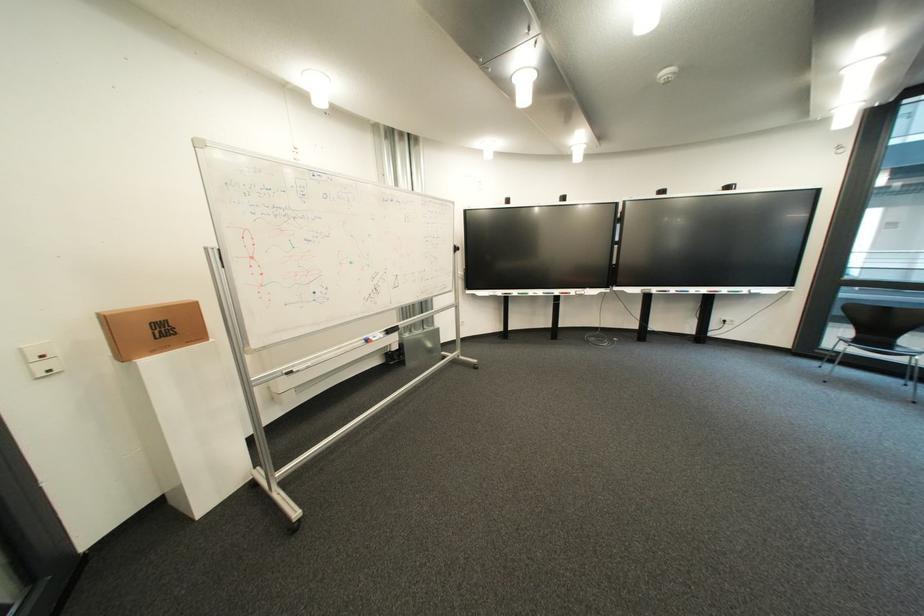
Where would you lift the whiteboard eraser? Please return your answer as a coordinate pair (x, y).

(378, 334)